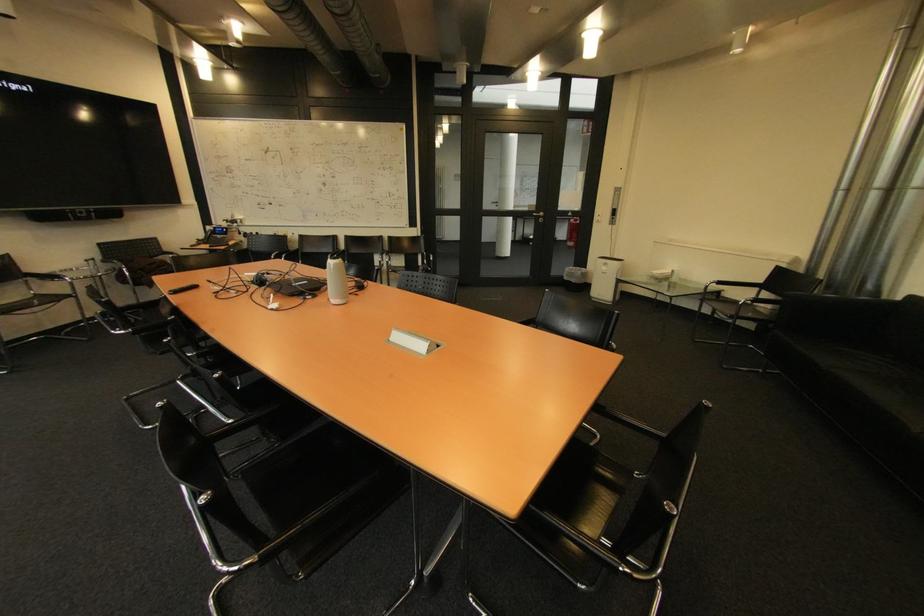
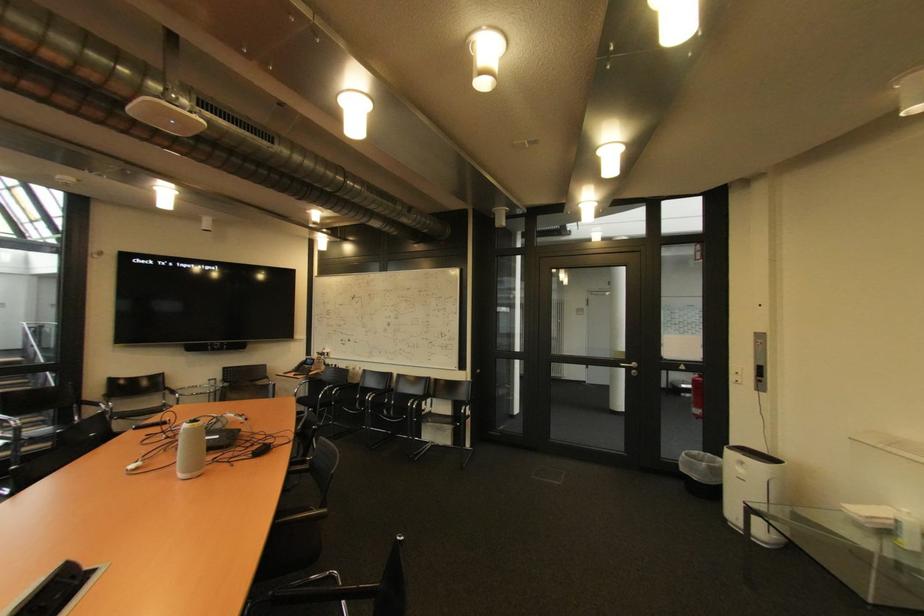
In the second image, find the point that corresponds to point (544, 219) in the first image.

(637, 371)